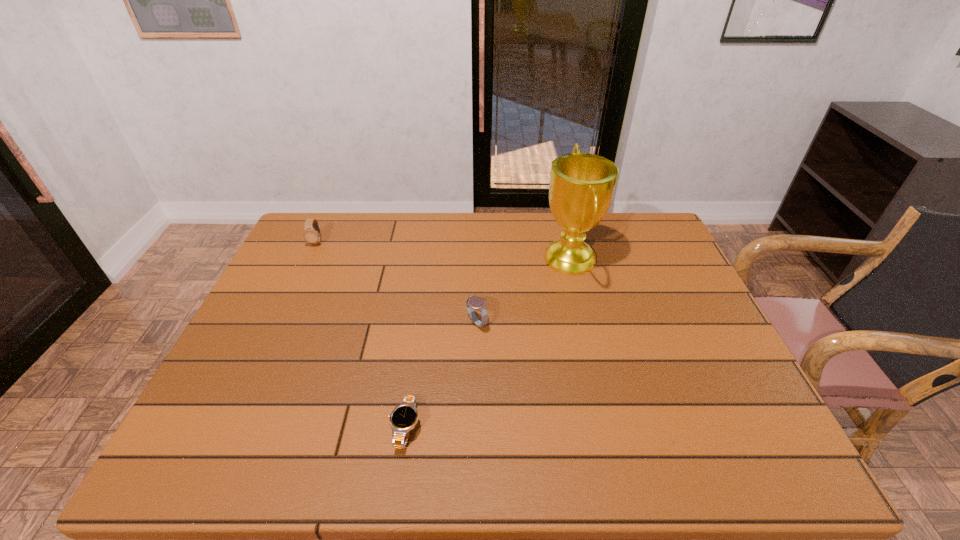
Where is `free space at the near edge`? The height and width of the screenshot is (540, 960). free space at the near edge is located at coordinates (270, 460).

I want to click on vacant space at the left edge, so [x=302, y=282].

I want to click on vacant space at the right edge, so click(x=679, y=262).

I want to click on empty space between the award and the second object from left to right, so click(488, 343).

Where is `blank region between the second nearest object and the shortest object`? This screenshot has height=540, width=960. blank region between the second nearest object and the shortest object is located at coordinates (441, 375).

This screenshot has height=540, width=960. What are the coordinates of `vacant area between the farthest watch and the shortest object` in the screenshot? It's located at (361, 335).

You are a GUI agent. You are given a task and a screenshot of the screen. Output one action in this format:
    pyautogui.click(x=<x>, y=<y>)
    Task: Click on the vacant area that lies between the shortest object and the leftmost watch
    The width and height of the screenshot is (960, 540).
    Given the screenshot: What is the action you would take?
    click(361, 335)

The width and height of the screenshot is (960, 540). What are the coordinates of `vacant area that lies between the rightmost object and the farthest watch` in the screenshot? It's located at (444, 251).

The image size is (960, 540). I want to click on free point between the shortest watch and the award, so click(488, 343).

Locate an element on the screen. The width and height of the screenshot is (960, 540). vacant area that lies between the shortest watch and the farthest watch is located at coordinates (361, 335).